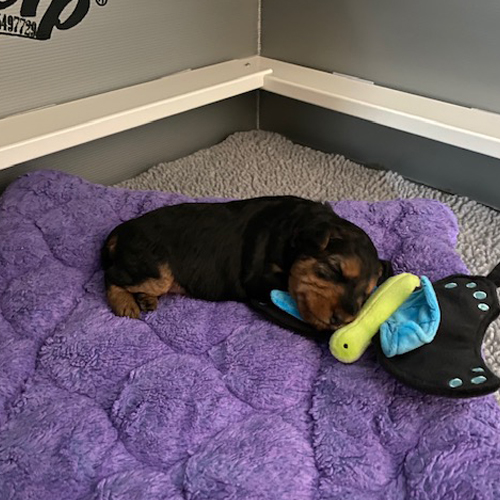
I want to click on bed above dog's face, so click(x=391, y=232).